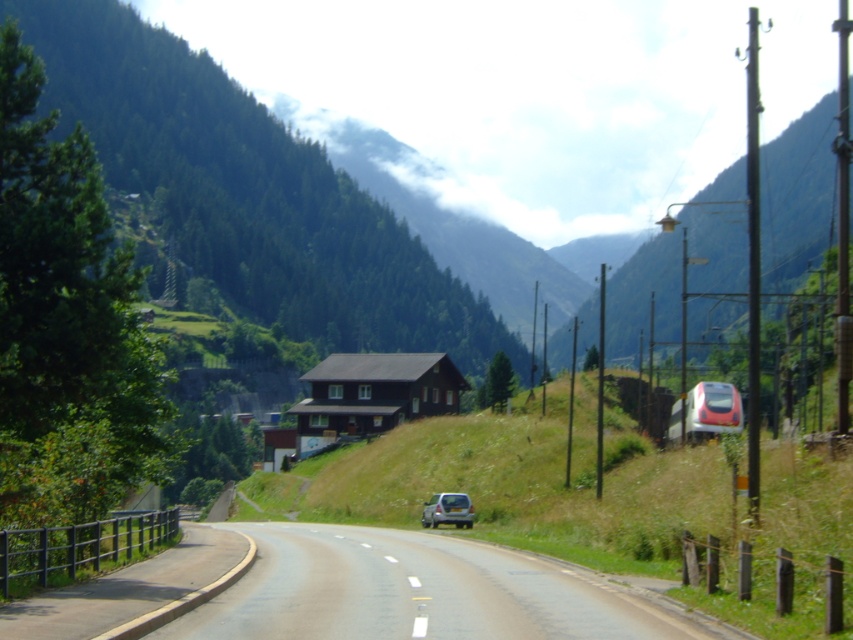
Does smooth asphalt road at center appear under silver metallic suv at center?

No, smooth asphalt road at center is not below silver metallic suv at center.

Does smooth asphalt road at center have a lesser width compared to silver metallic suv at center?

Incorrect, smooth asphalt road at center's width is not less than silver metallic suv at center's.

Who is more forward, (590, 609) or (461, 515)?

Point (590, 609) is more forward.

Where is `smooth asphalt road at center`? The image size is (853, 640). smooth asphalt road at center is located at coordinates (360, 592).